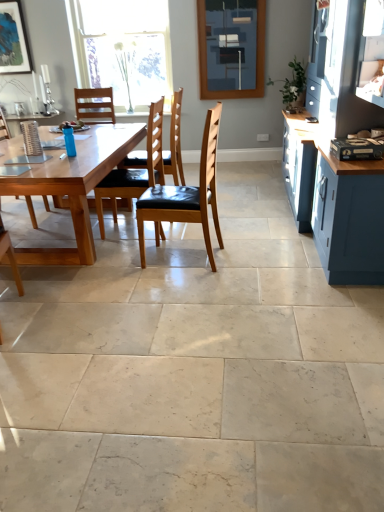
Where is `brown leather chair at center, placed as the fourth chair when sorted from left to right`? brown leather chair at center, placed as the fourth chair when sorted from left to right is located at coordinates (187, 195).

How much space does wooden chair with black cushion at center, the 2th chair viewed from the right, occupy vertically?

wooden chair with black cushion at center, the 2th chair viewed from the right, is 1.14 meters in height.

Find the location of a particular element. This screenshot has width=384, height=512. wooden chair with black cushion at center, which is the 3th chair from left to right is located at coordinates (175, 143).

Where is `matte glass window screen at upper center`? The width and height of the screenshot is (384, 512). matte glass window screen at upper center is located at coordinates (231, 48).

Describe the element at coordinates (334, 157) in the screenshot. I see `matte blue cabinet at right` at that location.

In order to click on wooden chair at left, which ranks as the 1th chair in left-to-right order in this screenshot , I will do `click(31, 212)`.

Locate an element on the screen. The width and height of the screenshot is (384, 512). natural wood table at center is located at coordinates (74, 187).

In the scene shown: Between wooden chair at center, marked as the third chair in a right-to-left arrangement, and wooden chair with black cushion at center, the 2th chair viewed from the right, which one is positioned behind?

wooden chair with black cushion at center, the 2th chair viewed from the right, is further from the camera.

In order to click on the 2nd chair behind the wooden chair at center, marked as the third chair in a right-to-left arrangement, starting your count from the anchor in this screenshot , I will do `click(175, 143)`.

Based on the photo, from a real-world perspective, is matte blue cabinet at right below natural wood table at center?

Incorrect, from a real-world perspective, matte blue cabinet at right is higher than natural wood table at center.

Is natural wood table at center at the back of matte blue cabinet at right?

No.

Considering the relative positions of matte blue cabinet at right and natural wood table at center in the image provided, is matte blue cabinet at right to the right of natural wood table at center from the viewer's perspective?

Yes, matte blue cabinet at right is to the right of natural wood table at center.

Is matte blue cabinet at right inside the boundaries of natural wood table at center, or outside?

matte blue cabinet at right exists outside the volume of natural wood table at center.

From a real-world perspective, is wooden chair with black cushion at center, the 2th chair viewed from the right, below wooden chair at center, marked as the third chair in a right-to-left arrangement?

No, from a real-world perspective, wooden chair with black cushion at center, the 2th chair viewed from the right, is not beneath wooden chair at center, marked as the third chair in a right-to-left arrangement.

From the image's perspective, which one is positioned higher, wooden chair with black cushion at center, which is the 3th chair from left to right, or wooden chair at center, marked as the third chair in a right-to-left arrangement?

wooden chair with black cushion at center, which is the 3th chair from left to right, from the image's perspective.

From the picture: Is wooden chair with black cushion at center, which is the 3th chair from left to right, outside of wooden chair at center, marked as the third chair in a right-to-left arrangement?

Indeed, wooden chair with black cushion at center, which is the 3th chair from left to right, is completely outside wooden chair at center, marked as the third chair in a right-to-left arrangement.

From the wooden chair with black cushion at center, the 2th chair viewed from the right, count 2nd chairs forward and point to it. Please provide its 2D coordinates.

[(135, 170)]

Which object is positioned more to the right, natural wood table at center or matte blue cabinet at right?

Positioned to the right is matte blue cabinet at right.

Is natural wood table at center not near matte blue cabinet at right?

Yes, natural wood table at center is far from matte blue cabinet at right.

Is natural wood table at center looking in the opposite direction of matte blue cabinet at right?

natural wood table at center does not have its back to matte blue cabinet at right.

Based on the photo, measure the distance from natural wood table at center to matte blue cabinet at right.

The distance of natural wood table at center from matte blue cabinet at right is 5.55 feet.

From the image's perspective, is wooden chair at center, acting as the second chair starting from the left, positioned above or below matte black picture frame at upper left?

wooden chair at center, acting as the second chair starting from the left, is below matte black picture frame at upper left.

From a real-world perspective, is wooden chair at center, acting as the second chair starting from the left, physically located above or below matte black picture frame at upper left?

wooden chair at center, acting as the second chair starting from the left, is situated lower than matte black picture frame at upper left in the real world.

Does wooden chair at center, acting as the second chair starting from the left, touch matte black picture frame at upper left?

No, wooden chair at center, acting as the second chair starting from the left, is not with matte black picture frame at upper left.

Considering the relative sizes of wooden chair at center, marked as the third chair in a right-to-left arrangement, and matte black picture frame at upper left in the image provided, is wooden chair at center, marked as the third chair in a right-to-left arrangement, taller than matte black picture frame at upper left?

Yes.

Based on the photo, from a real-world perspective, between matte glass window screen at upper center and wooden chair at left, which ranks as the 1th chair in left-to-right order, who is vertically higher?

matte glass window screen at upper center, from a real-world perspective.

Which object is wider, matte glass window screen at upper center or wooden chair at left, arranged as the fourth chair when viewed from the right?

wooden chair at left, arranged as the fourth chair when viewed from the right, is wider.

From the image's perspective, which is below, matte glass window screen at upper center or wooden chair at left, which ranks as the 1th chair in left-to-right order?

wooden chair at left, which ranks as the 1th chair in left-to-right order, is shown below in the image.

Is matte glass window screen at upper center oriented away from wooden chair at left, which ranks as the 1th chair in left-to-right order?

matte glass window screen at upper center does not have its back to wooden chair at left, which ranks as the 1th chair in left-to-right order.

From the picture: Considering the relative positions of clear glass window at upper center and matte black picture frame at upper left in the image provided, is clear glass window at upper center to the left of matte black picture frame at upper left from the viewer's perspective?

Incorrect, clear glass window at upper center is not on the left side of matte black picture frame at upper left.

From a real-world perspective, is clear glass window at upper center positioned above or below matte black picture frame at upper left?

clear glass window at upper center is situated lower than matte black picture frame at upper left in the real world.

Based on the photo, is clear glass window at upper center taller than matte black picture frame at upper left?

Yes.

Where is `chair that is the 2nd object located in front of the wooden chair with black cushion at center, the 2th chair viewed from the right`? Image resolution: width=384 pixels, height=512 pixels. chair that is the 2nd object located in front of the wooden chair with black cushion at center, the 2th chair viewed from the right is located at coordinates (135, 170).

You are a GUI agent. You are given a task and a screenshot of the screen. Output one action in this format:
    pyautogui.click(x=<x>, y=<y>)
    Task: Click on the cabinetry located on the right of natural wood table at center
    The height and width of the screenshot is (512, 384).
    Given the screenshot: What is the action you would take?
    pyautogui.click(x=334, y=157)

Based on their spatial positions, is wooden chair with black cushion at center, which is the 3th chair from left to right, or matte blue cabinet at right further from matte black picture frame at upper left?

matte blue cabinet at right is positioned further to the anchor matte black picture frame at upper left.

From the image, which object appears to be nearer to brown leather chair at center, placed as the fourth chair when sorted from left to right, wooden chair at left, arranged as the fourth chair when viewed from the right, or matte black picture frame at upper left?

wooden chair at left, arranged as the fourth chair when viewed from the right, is positioned closer to the anchor brown leather chair at center, placed as the fourth chair when sorted from left to right.

When comparing their distances from natural wood table at center, does matte blue cabinet at right or matte glass window screen at upper center seem further?

matte glass window screen at upper center lies further to natural wood table at center than the other object.

Which object lies nearer to the anchor point wooden chair at left, which ranks as the 1th chair in left-to-right order, brown leather chair at center, the first chair from the right, or matte glass window screen at upper center?

brown leather chair at center, the first chair from the right, is closer to wooden chair at left, which ranks as the 1th chair in left-to-right order.

Considering their positions, is clear glass window at upper center positioned closer to matte blue cabinet at right than matte glass window screen at upper center?

matte glass window screen at upper center lies closer to matte blue cabinet at right than the other object.

Estimate the real-world distances between objects in this image. Which object is further from matte black picture frame at upper left, matte glass window screen at upper center or clear glass window at upper center?

Among the two, matte glass window screen at upper center is located further to matte black picture frame at upper left.

Estimate the real-world distances between objects in this image. Which object is further from wooden chair with black cushion at center, the 2th chair viewed from the right, wooden chair at center, marked as the third chair in a right-to-left arrangement, or wooden chair at left, arranged as the fourth chair when viewed from the right?

The object further to wooden chair with black cushion at center, the 2th chair viewed from the right, is wooden chair at left, arranged as the fourth chair when viewed from the right.

From the image, which object appears to be nearer to brown leather chair at center, placed as the fourth chair when sorted from left to right, matte black picture frame at upper left or wooden chair with black cushion at center, which is the 3th chair from left to right?

wooden chair with black cushion at center, which is the 3th chair from left to right, lies closer to brown leather chair at center, placed as the fourth chair when sorted from left to right, than the other object.

Where is `window located between matte black picture frame at upper left and matte glass window screen at upper center in the left-right direction`? window located between matte black picture frame at upper left and matte glass window screen at upper center in the left-right direction is located at coordinates (123, 49).

Where is `kitchen & dining room table between wooden chair at left, arranged as the fourth chair when viewed from the right, and brown leather chair at center, the first chair from the right, from left to right`? This screenshot has height=512, width=384. kitchen & dining room table between wooden chair at left, arranged as the fourth chair when viewed from the right, and brown leather chair at center, the first chair from the right, from left to right is located at coordinates (74, 187).

Where is `kitchen & dining room table between matte blue cabinet at right and clear glass window at upper center from front to back`? Image resolution: width=384 pixels, height=512 pixels. kitchen & dining room table between matte blue cabinet at right and clear glass window at upper center from front to back is located at coordinates pos(74,187).

I want to click on window screen between clear glass window at upper center and wooden chair with black cushion at center, which is the 3th chair from left to right, in the up-down direction, so click(x=231, y=48).